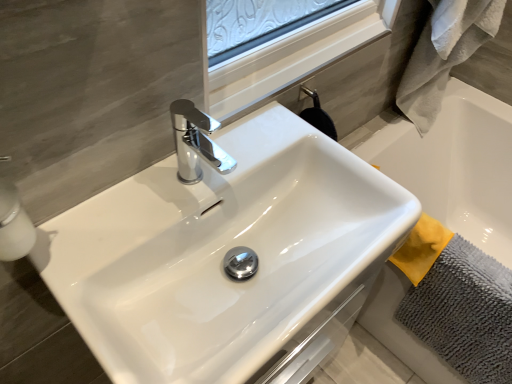
Question: Does gray microfiber bath towel at lower right, the second bath towel in the top-to-bottom sequence, have a greater width compared to gray fluffy bath towel at right, which is the 2th bath towel from bottom to top?

Choices:
 (A) no
 (B) yes

Answer: (A)

Question: Does gray microfiber bath towel at lower right, the 1th bath towel when ordered from bottom to top, have a lesser width compared to gray fluffy bath towel at right, which is the 2th bath towel from bottom to top?

Choices:
 (A) yes
 (B) no

Answer: (A)

Question: Does gray microfiber bath towel at lower right, the second bath towel in the top-to-bottom sequence, come behind gray fluffy bath towel at right, which is the 2th bath towel from bottom to top?

Choices:
 (A) no
 (B) yes

Answer: (A)

Question: Is gray microfiber bath towel at lower right, the second bath towel in the top-to-bottom sequence, closer to camera compared to gray fluffy bath towel at right, which is the 2th bath towel from bottom to top?

Choices:
 (A) no
 (B) yes

Answer: (B)

Question: Can you confirm if gray microfiber bath towel at lower right, the 1th bath towel when ordered from bottom to top, is positioned to the left of gray fluffy bath towel at right, which is the 2th bath towel from bottom to top?

Choices:
 (A) yes
 (B) no

Answer: (B)

Question: From the image's perspective, is white glossy soap dispenser at left above or below gray microfiber bath towel at lower right, the 1th bath towel when ordered from bottom to top?

Choices:
 (A) above
 (B) below

Answer: (A)

Question: Is white glossy soap dispenser at left taller or shorter than gray microfiber bath towel at lower right, the second bath towel in the top-to-bottom sequence?

Choices:
 (A) short
 (B) tall

Answer: (A)

Question: In terms of width, does white glossy soap dispenser at left look wider or thinner when compared to gray microfiber bath towel at lower right, the second bath towel in the top-to-bottom sequence?

Choices:
 (A) wide
 (B) thin

Answer: (B)

Question: Choose the correct answer: Is white glossy soap dispenser at left inside gray microfiber bath towel at lower right, the second bath towel in the top-to-bottom sequence, or outside it?

Choices:
 (A) outside
 (B) inside

Answer: (A)

Question: From a real-world perspective, is gray fluffy bath towel at right, which is the 2th bath towel from bottom to top, positioned above or below white glossy sink at center?

Choices:
 (A) above
 (B) below

Answer: (A)

Question: From the image's perspective, is gray fluffy bath towel at right, acting as the first bath towel starting from the top, located above or below white glossy sink at center?

Choices:
 (A) above
 (B) below

Answer: (A)

Question: In the image, is gray fluffy bath towel at right, which is the 2th bath towel from bottom to top, positioned in front of or behind white glossy sink at center?

Choices:
 (A) behind
 (B) front

Answer: (A)

Question: Considering the positions of gray fluffy bath towel at right, acting as the first bath towel starting from the top, and white glossy sink at center in the image, is gray fluffy bath towel at right, acting as the first bath towel starting from the top, wider or thinner than white glossy sink at center?

Choices:
 (A) thin
 (B) wide

Answer: (A)

Question: From a real-world perspective, is gray microfiber bath towel at lower right, the 1th bath towel when ordered from bottom to top, above or below gray fluffy bath towel at right, acting as the first bath towel starting from the top?

Choices:
 (A) above
 (B) below

Answer: (B)

Question: In the image, is gray microfiber bath towel at lower right, the 1th bath towel when ordered from bottom to top, positioned in front of or behind gray fluffy bath towel at right, acting as the first bath towel starting from the top?

Choices:
 (A) behind
 (B) front

Answer: (B)